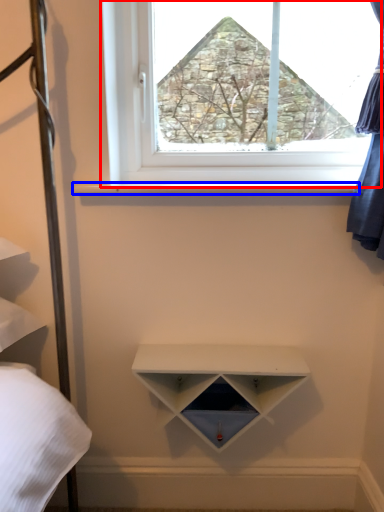
Question: Which point is further to the camera, window (highlighted by a red box) or window sill (highlighted by a blue box)?

Choices:
 (A) window
 (B) window sill

Answer: (A)